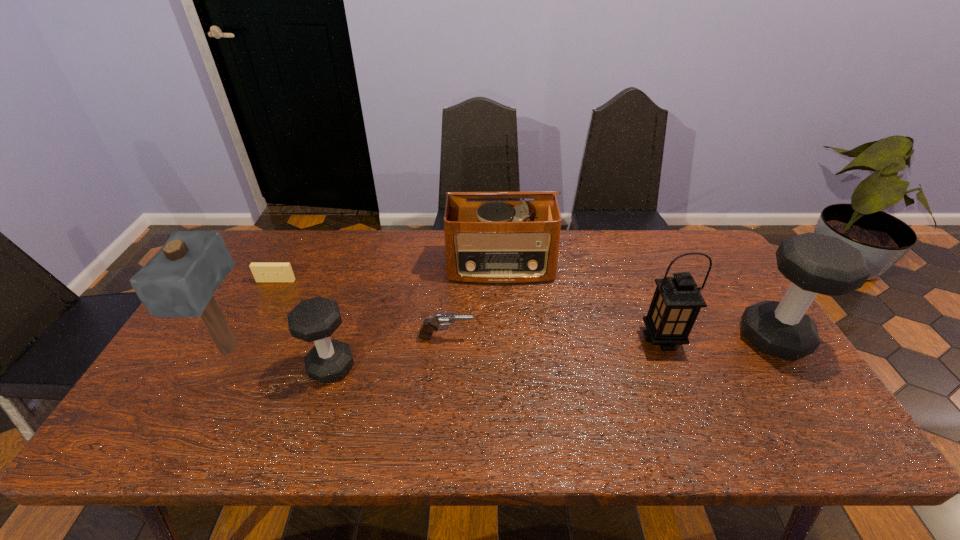
Image resolution: width=960 pixels, height=540 pixels. I want to click on vacant space located 0.350m on the back of the taller dumbbell, so click(709, 242).

This screenshot has height=540, width=960. What are the coordinates of `free region located 0.160m at the front of the shortest object with spools` in the screenshot? It's located at (255, 321).

The image size is (960, 540). I want to click on blank space located on the front panel of the radio receiver, so click(x=503, y=312).

Identify the location of blank area located 0.300m on the back of the mallet. (279, 258).

The height and width of the screenshot is (540, 960). I want to click on free space located 0.390m at the barrel of the pistol, so click(x=616, y=338).

Locate an element on the screen. free space located on the back of the lantern is located at coordinates (643, 293).

Where is `object that is at the far edge`? The height and width of the screenshot is (540, 960). object that is at the far edge is located at coordinates (486, 242).

Identify the location of object that is at the near edge. (316, 319).

The width and height of the screenshot is (960, 540). I want to click on videotape at the left edge, so click(263, 272).

Where is `mallet that is at the left edge`? This screenshot has height=540, width=960. mallet that is at the left edge is located at coordinates (180, 280).